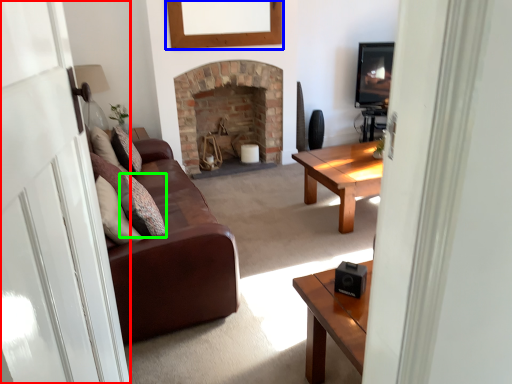
Question: Based on their relative distances, which object is nearer to glass door (highlighted by a red box)? Choose from picture frame (highlighted by a blue box) and pillow (highlighted by a green box).

Choices:
 (A) picture frame
 (B) pillow

Answer: (B)